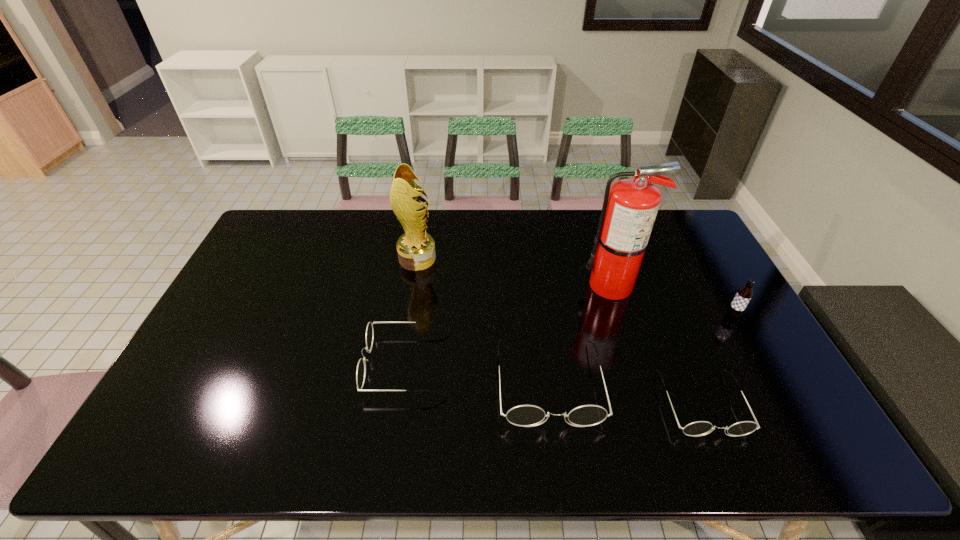
This screenshot has width=960, height=540. Identify the location of the leftmost spectacles. (361, 367).

What are the coordinates of `the second shortest object` in the screenshot? It's located at (361, 367).

At what (x,y) coordinates should I click in order to perform the action: click on the second spectacles from right to left. Please return your answer as a coordinate pair (x, y). The height and width of the screenshot is (540, 960). Looking at the image, I should click on (524, 415).

Identify the location of the rightmost spectacles. This screenshot has width=960, height=540. (700, 428).

Identify the location of the shortest spectacles. The width and height of the screenshot is (960, 540). (700, 428).

Identify the location of the fourth shortest object. (744, 294).

Locate an element on the screen. the rightmost object is located at coordinates (744, 294).

The height and width of the screenshot is (540, 960). In order to click on fire extinguisher in this screenshot , I will do `click(630, 206)`.

Locate an element on the screen. The image size is (960, 540). the second tallest object is located at coordinates (416, 249).

This screenshot has width=960, height=540. What are the coordinates of `free location located 0.330m on the front-facing side of the fifth tallest object` in the screenshot? It's located at (243, 364).